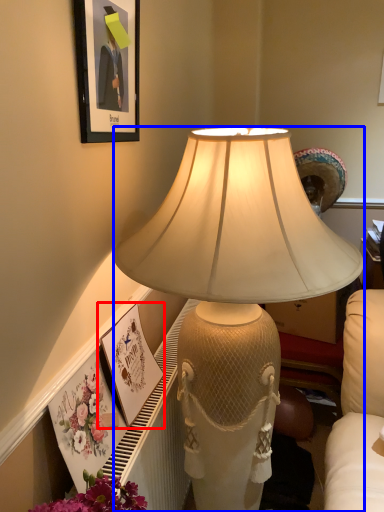
Question: Which of the following is the farthest to the observer, picture frame (highlighted by a red box) or lamp (highlighted by a blue box)?

Choices:
 (A) picture frame
 (B) lamp

Answer: (A)